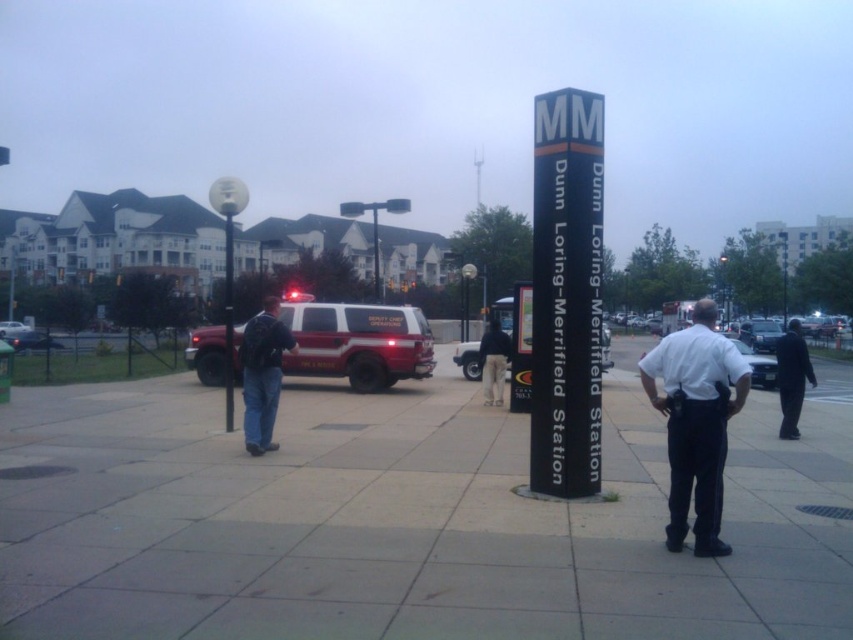
Which is more to the right, white uniform at center or metallic streetlight at center?

From the viewer's perspective, white uniform at center appears more on the right side.

Which of these two, white uniform at center or metallic streetlight at center, stands taller?

metallic streetlight at center is taller.

Who is more forward, (699, 353) or (231, 253)?

Point (699, 353)

You are a GUI agent. You are given a task and a screenshot of the screen. Output one action in this format:
    pyautogui.click(x=<x>, y=<y>)
    Task: Click on the white uniform at center
    The height and width of the screenshot is (640, 853).
    Given the screenshot: What is the action you would take?
    pyautogui.click(x=695, y=422)

Is red matte fire truck at center positioned behind metallic streetlight at center?

No, it is in front of metallic streetlight at center.

Does red matte fire truck at center have a lesser width compared to metallic streetlight at center?

Indeed, red matte fire truck at center has a lesser width compared to metallic streetlight at center.

Is point (393, 324) less distant than point (225, 273)?

That is True.

At what (x,y) coordinates should I click in order to perform the action: click on red matte fire truck at center. Please return your answer as a coordinate pair (x, y). Looking at the image, I should click on (358, 342).

Does smooth concrete pavement at center appear under red matte fire truck at center?

Correct, smooth concrete pavement at center is located below red matte fire truck at center.

Between smooth concrete pavement at center and red matte fire truck at center, which one is positioned lower?

Positioned lower is smooth concrete pavement at center.

At what (x,y) coordinates should I click in order to perform the action: click on smooth concrete pavement at center. Please return your answer as a coordinate pair (x, y). The width and height of the screenshot is (853, 640). Looking at the image, I should click on (404, 520).